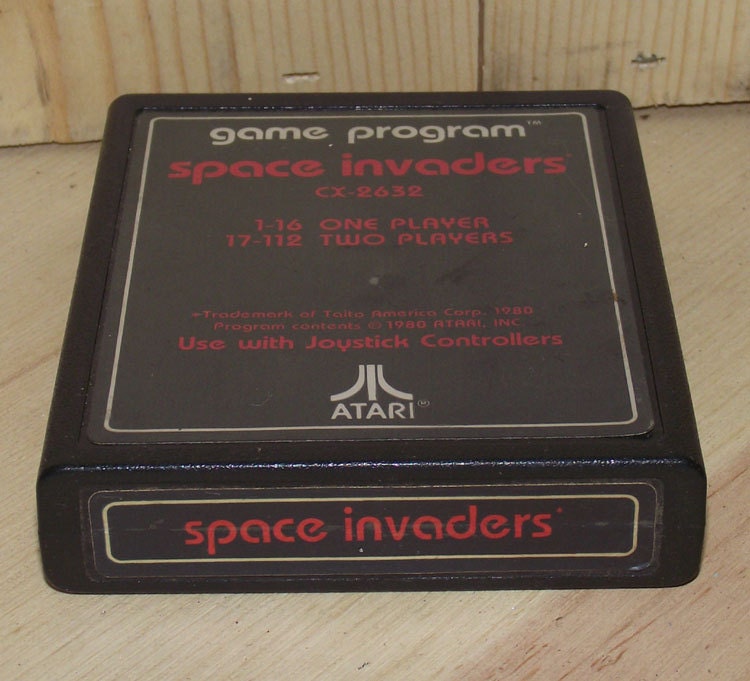
At what (x,y) coordinates should I click in order to perform the action: click on box. Please return your answer as a coordinate pair (x, y). This screenshot has width=750, height=681. Looking at the image, I should click on (612, 455).